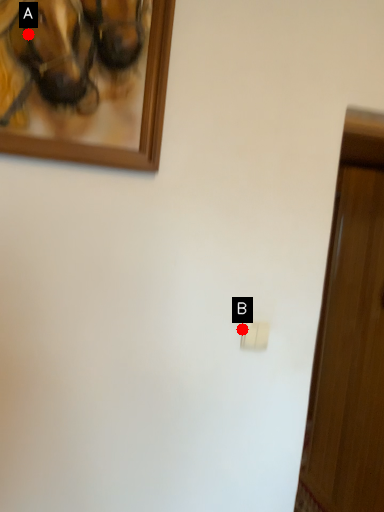
Question: Two points are circled on the image, labeled by A and B beside each circle. Which point is closer to the camera?

Choices:
 (A) A is closer
 (B) B is closer

Answer: (A)